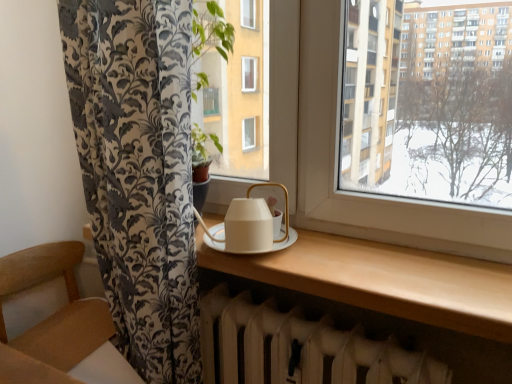
I want to click on empty space that is to the right of white matte tea set at center, so click(337, 249).